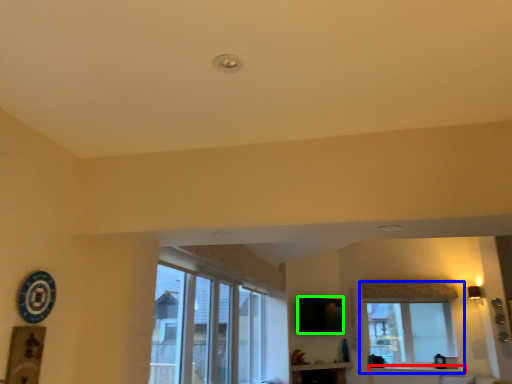
Question: Which object is the farthest from window sill (highlighted by a red box)? Choose among these: window (highlighted by a blue box) or window screen (highlighted by a green box).

Choices:
 (A) window
 (B) window screen

Answer: (B)